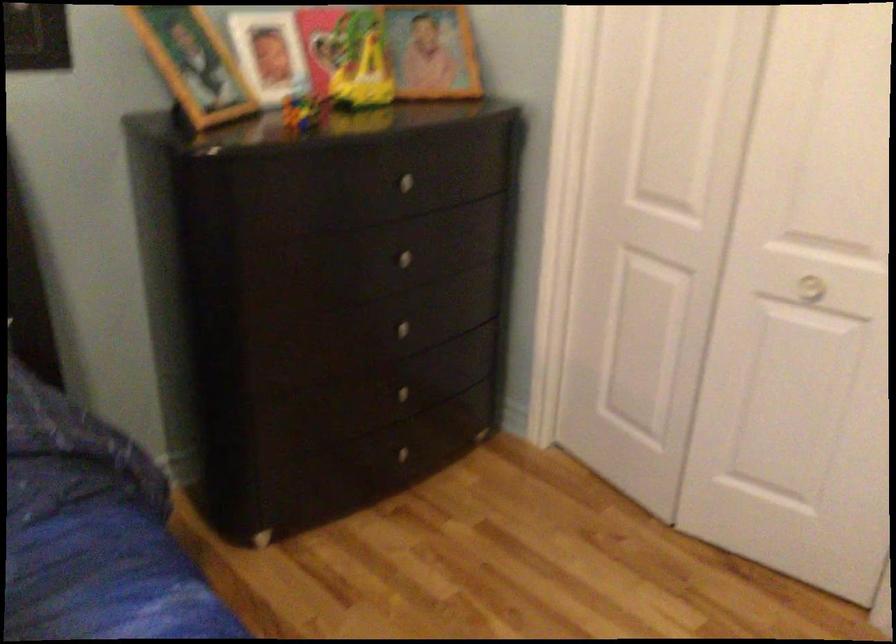
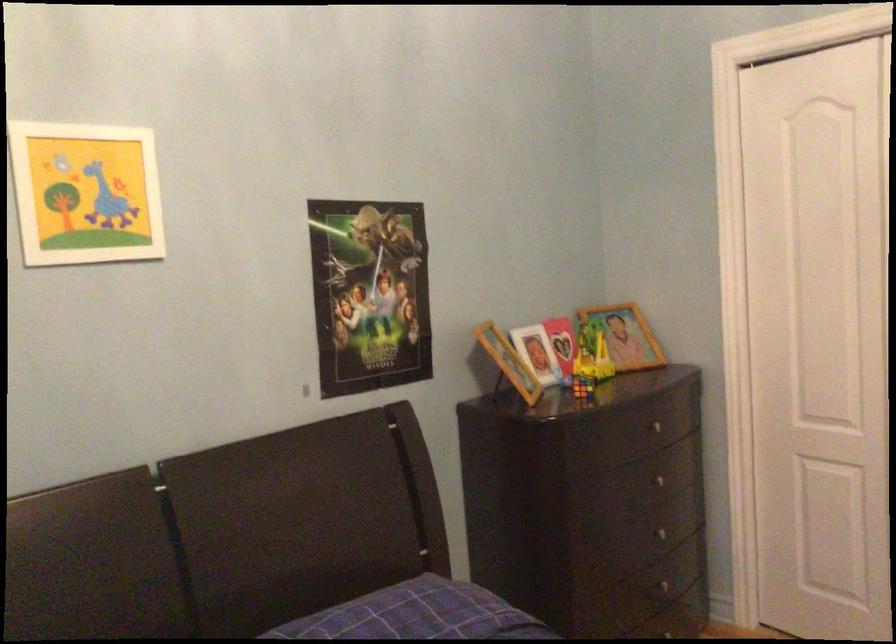
In the scene shown: The images are taken continuously from a first-person perspective. In which direction are you moving?

The cameraman walked toward left, backward.